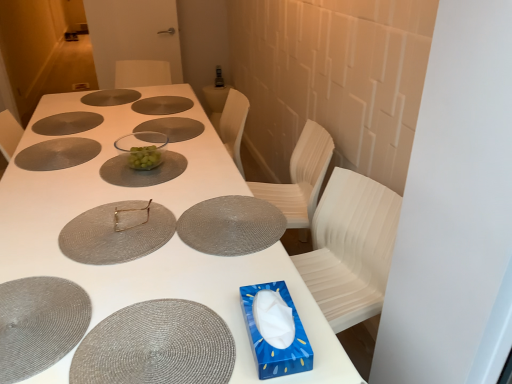
Where is `vacant area to the right of transparent glass bowl at center, acting as the sixth glass plate starting from the back`? Image resolution: width=512 pixels, height=384 pixels. vacant area to the right of transparent glass bowl at center, acting as the sixth glass plate starting from the back is located at coordinates (207, 166).